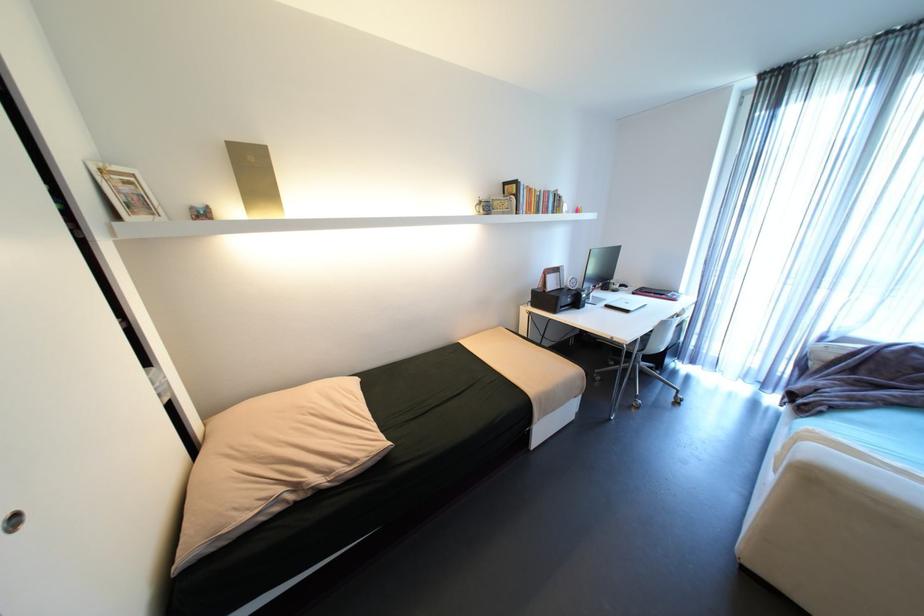
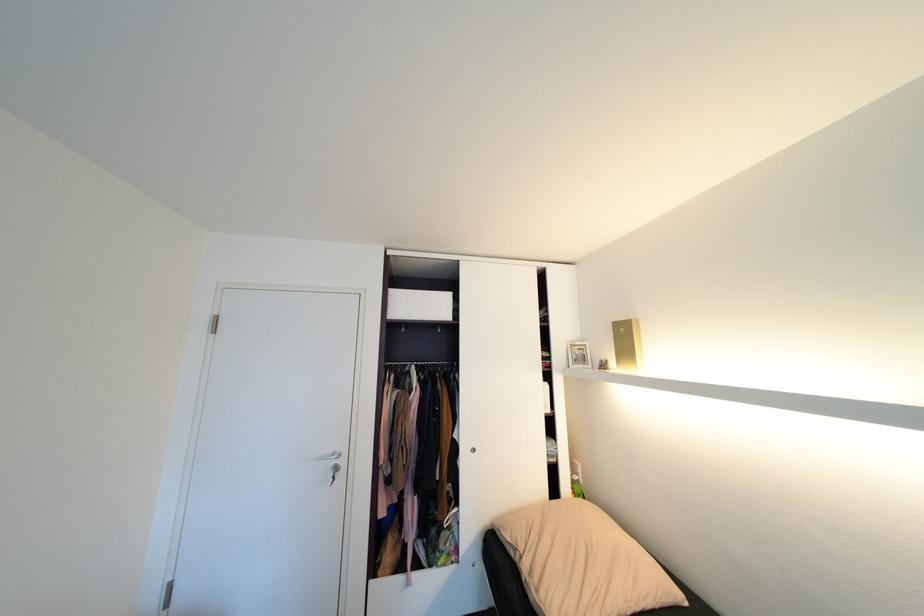
Find the pixel in the second image that matches [135,183] in the first image.

(587, 350)